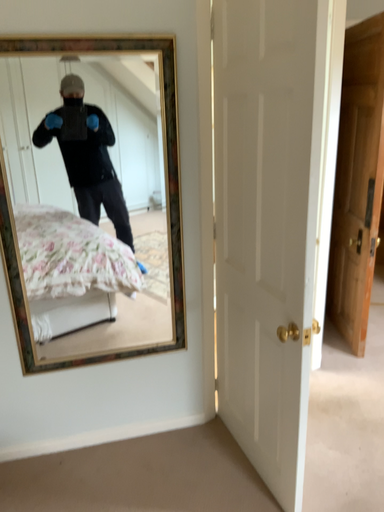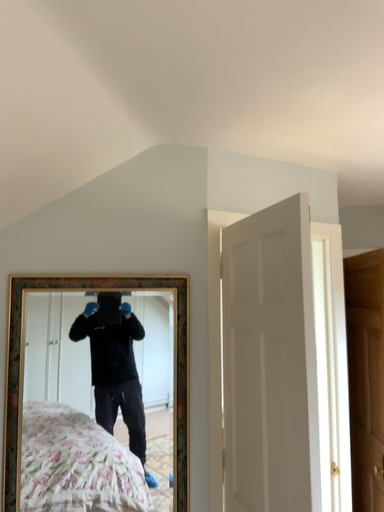
Question: How did the camera likely rotate when shooting the video?

Choices:
 (A) rotated downward
 (B) rotated upward

Answer: (B)